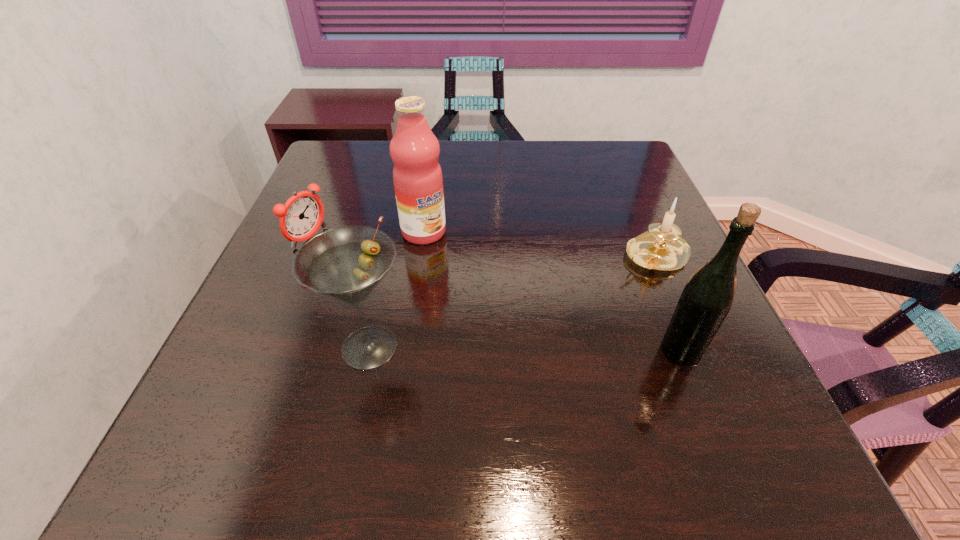
Locate an element on the screen. Image resolution: width=960 pixels, height=540 pixels. vacant region located on the label of the fruit juice is located at coordinates (508, 321).

Image resolution: width=960 pixels, height=540 pixels. What are the coordinates of `free space located on the front-facing side of the leftmost object` in the screenshot? It's located at (403, 286).

Image resolution: width=960 pixels, height=540 pixels. What are the coordinates of `free location located on the front-facing side of the leftmost object` in the screenshot? It's located at (347, 258).

Locate an element on the screen. vacant region located 0.240m on the front-facing side of the leftmost object is located at coordinates (403, 286).

This screenshot has width=960, height=540. Find the location of `vacant space located on the handle side of the second shortest object`. vacant space located on the handle side of the second shortest object is located at coordinates (573, 296).

At what (x,y) coordinates should I click in order to perform the action: click on vacant region located on the handle side of the second shortest object. Please return your answer as a coordinate pair (x, y). The width and height of the screenshot is (960, 540). Looking at the image, I should click on (542, 312).

I want to click on vacant area situated on the handle side of the second shortest object, so click(x=479, y=347).

Where is `object that is at the near edge`? The height and width of the screenshot is (540, 960). object that is at the near edge is located at coordinates (346, 263).

What are the coordinates of `object at the left edge` in the screenshot? It's located at (302, 215).

At what (x,y) coordinates should I click in order to perform the action: click on beer bottle that is at the right edge. Please return your answer as a coordinate pair (x, y). Looking at the image, I should click on (707, 297).